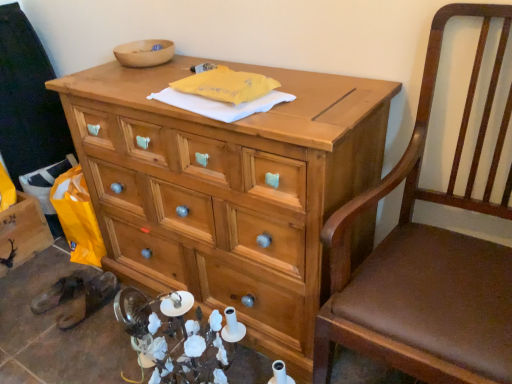
Locate an element on the screen. space that is in front of wooden bowl at upper center is located at coordinates (123, 73).